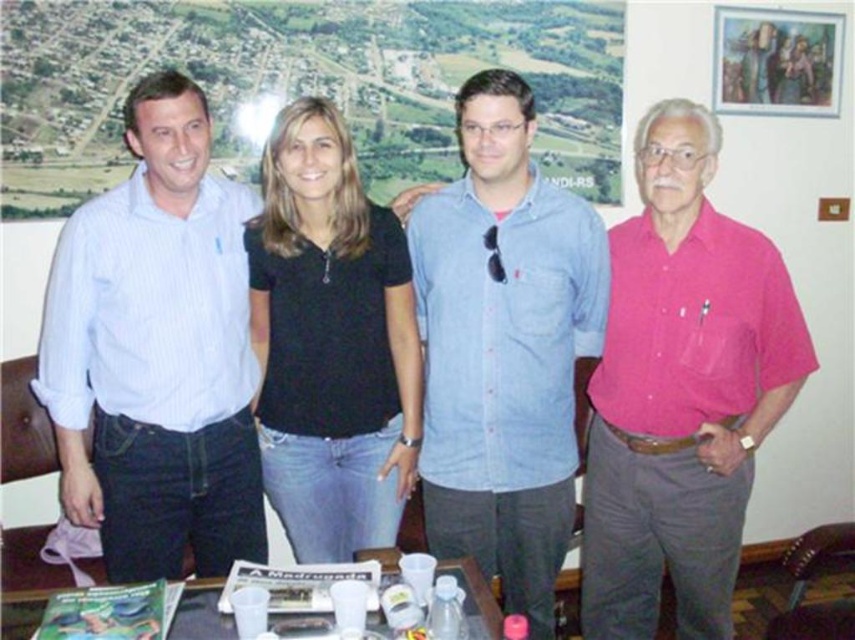
You are standing in front of the group of people in the image. You notice two points marked on the floor. One is at coordinate point(205, 328) and the other at point(600, 312). Which point is closer to you?

Point(205, 328) is closer to you because it is in front of point(600, 312).

Based on the scene description, which object is larger in size between the light blue striped shirt at left and the black cotton shirt at center?

The light blue striped shirt at left is larger in size compared to the black cotton shirt at center according to the description.

You are trying to find the light blue striped shirt at left and the denim shirt at center in the image. Which one is located to the left of the other?

The light blue striped shirt at left is positioned on the left side of denim shirt at center.